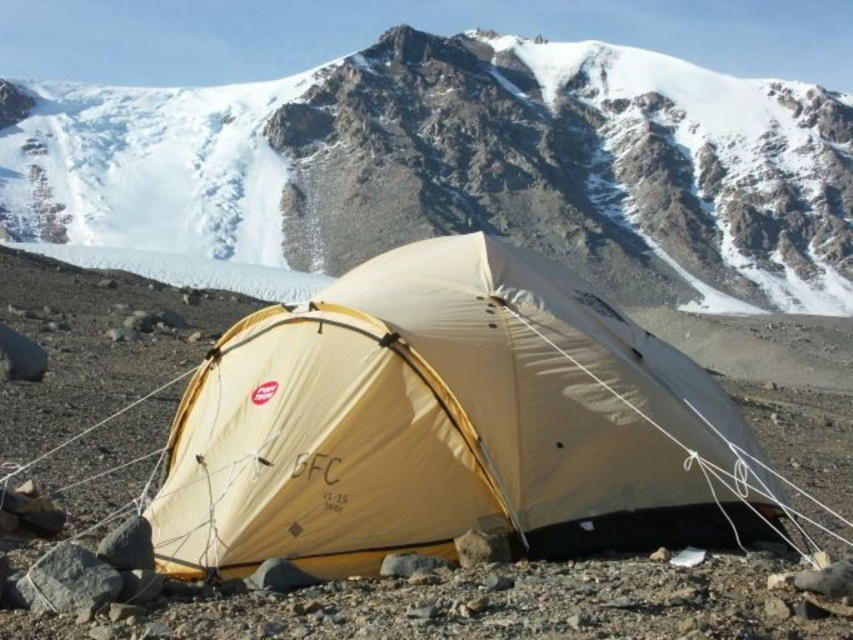
Does white matte tent at center have a smaller size compared to beige nylon tent at center?

No, white matte tent at center is not smaller than beige nylon tent at center.

What do you see at coordinates (462, 166) in the screenshot? I see `white matte tent at center` at bounding box center [462, 166].

Looking at this image, who is more distant from viewer, [158,106] or [350,419]?

The point [158,106] is more distant.

At what (x,y) coordinates should I click in order to perform the action: click on white matte tent at center. Please return your answer as a coordinate pair (x, y). Looking at the image, I should click on (462, 166).